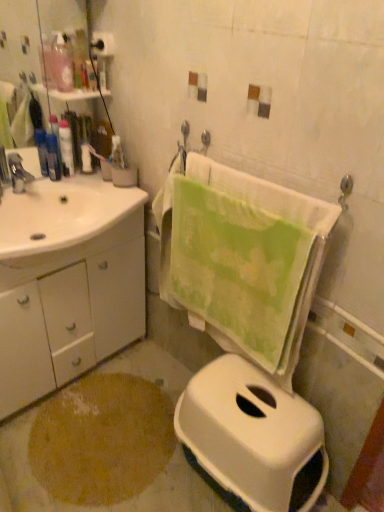
Question: Is matte silver faucet at left wider or thinner than green cotton towel at center?

Choices:
 (A) thin
 (B) wide

Answer: (B)

Question: From a real-world perspective, is matte silver faucet at left above or below green cotton towel at center?

Choices:
 (A) above
 (B) below

Answer: (A)

Question: Estimate the real-world distances between objects in this image. Which object is farther from the translucent plastic bottle at upper left, arranged as the 3th toiletry when viewed from the left?

Choices:
 (A) matte silver faucet at left
 (B) matte black lotion at left, which is counted as the 3th toiletry, starting from the right
 (C) white glossy cabinet at left
 (D) white glossy sink at left
 (E) brown textured rug at lower left

Answer: (E)

Question: Which object is the closest to the green cotton towel at center?

Choices:
 (A) matte black lotion at left, which is the 1th toiletry in left-to-right order
 (B) white glossy sink at left
 (C) matte silver faucet at left
 (D) matte black lotion at left, which ranks as the second toiletry in bottom-to-top order
 (E) white plastic toilet at lower right

Answer: (E)